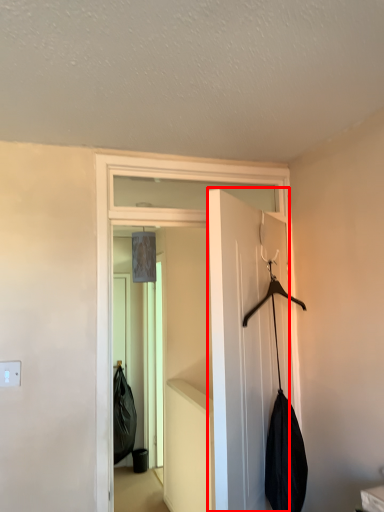
Question: From the image's perspective, considering the relative positions of door (annotated by the red box) and door in the image provided, where is door (annotated by the red box) located with respect to the staircase?

Choices:
 (A) above
 (B) below

Answer: (B)